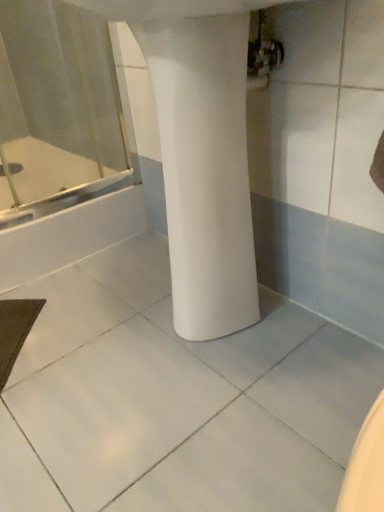
Question: Based on their positions, is white matte column at center located to the left or right of white glossy bathtub at left?

Choices:
 (A) left
 (B) right

Answer: (B)

Question: From the image's perspective, is white matte column at center above or below white glossy bathtub at left?

Choices:
 (A) below
 (B) above

Answer: (A)

Question: Considering the positions of white matte column at center and white glossy bathtub at left in the image, is white matte column at center wider or thinner than white glossy bathtub at left?

Choices:
 (A) thin
 (B) wide

Answer: (A)

Question: Is white glossy bathtub at left in front of or behind white matte column at center in the image?

Choices:
 (A) behind
 (B) front

Answer: (A)

Question: Considering the positions of white glossy bathtub at left and white matte column at center in the image, is white glossy bathtub at left wider or thinner than white matte column at center?

Choices:
 (A) thin
 (B) wide

Answer: (B)

Question: Is white glossy bathtub at left spatially inside white matte column at center, or outside of it?

Choices:
 (A) outside
 (B) inside

Answer: (A)

Question: From a real-world perspective, is white glossy bathtub at left positioned above or below white matte column at center?

Choices:
 (A) above
 (B) below

Answer: (B)